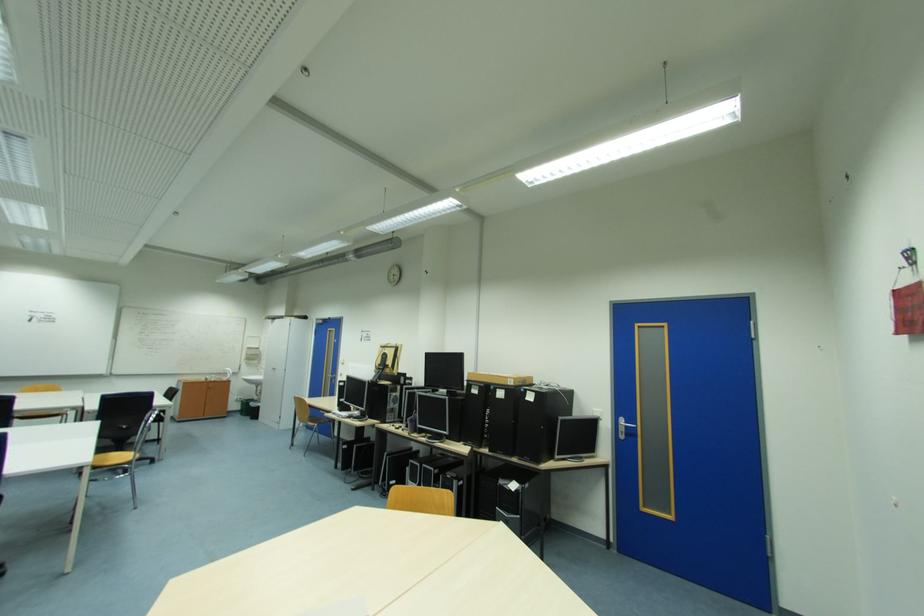
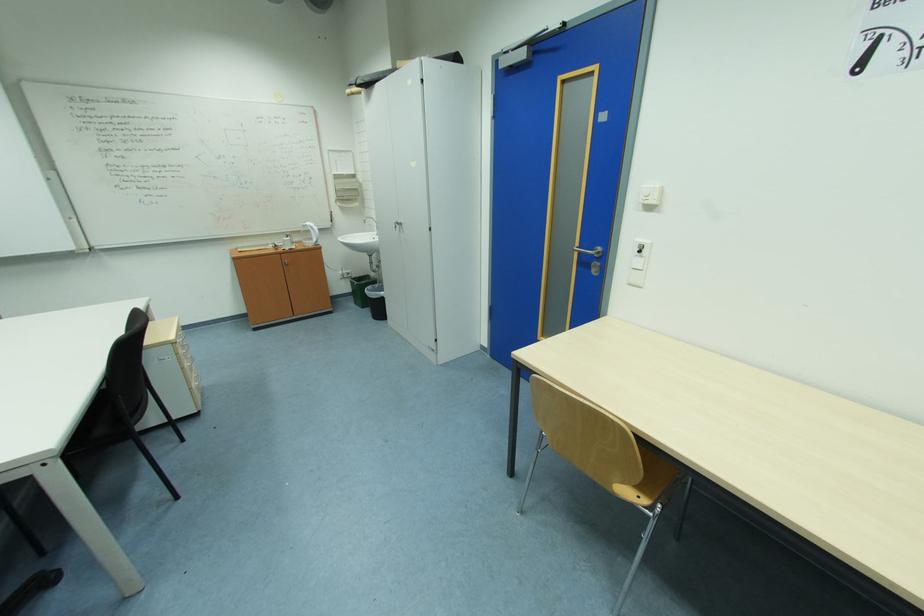
In the second image, find the point that corresponds to (338,381) in the first image.

(590, 264)